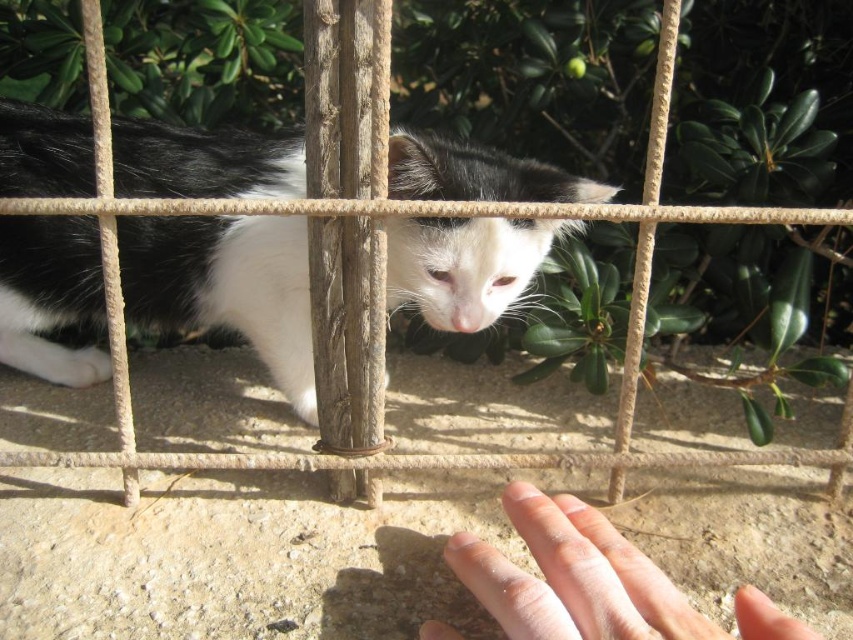
You are a photographer trying to capture the black and white fur cat at center and the pale skin at lower center in a single shot. Which object should you focus on first to ensure both are in frame?

The black and white fur cat at center is located above the pale skin at lower center, so you should focus on the black and white fur cat at center first to ensure both are in frame.

You are a photographer trying to capture the cat through the fence. You notice two points on the fence marked as point (x=64, y=144) and point (x=569, y=572). Which point is closer to your camera lens?

Point (x=64, y=144) is further to the camera than point (x=569, y=572). Therefore, point (x=64, y=144) is closer to the camera lens.

You are a photographer standing at a distance. You want to take a clear photo of the black and white fur cat at center through the metal grid fence. Considering the distance between you and the cat is 38.11 inches, will you be able to focus on the cat without the fence being in the way?

The black and white fur cat at center and camera are 38.11 inches apart. Since the fence is between you and the cat, it may obstruct the view. To focus on the cat without the fence being in the way, you would need to ensure the fence is not blocking the lens or adjust your position to minimize the fence in the frame.